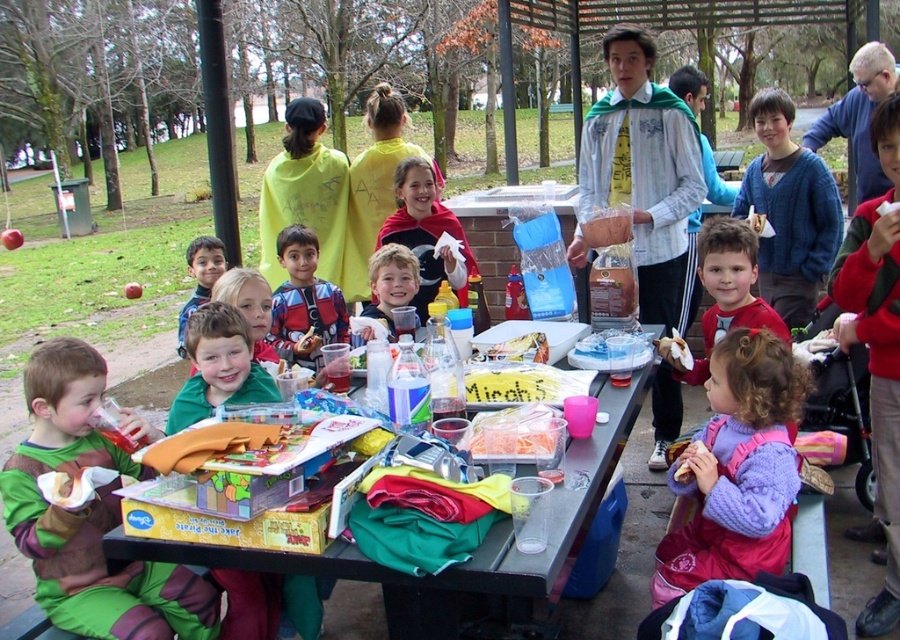
You are organizing a picnic and need to know which object occupies more space in the image. Based on the scene, which is bigger between the wooden picnic table at center and the smooth brown hair at center?

The wooden picnic table at center is larger in size than the smooth brown hair at center, so the wooden picnic table at center occupies more space in the image.

Looking at this image, you are a photographer standing at the edge of the pavilion. You want to take a photo of the wooden picnic table at center and the smooth brown hair at center. Based on their positions, which object will appear closer to the camera in the photo?

The wooden picnic table at center is in front of smooth brown hair at center, so it will appear closer to the camera in the photo.